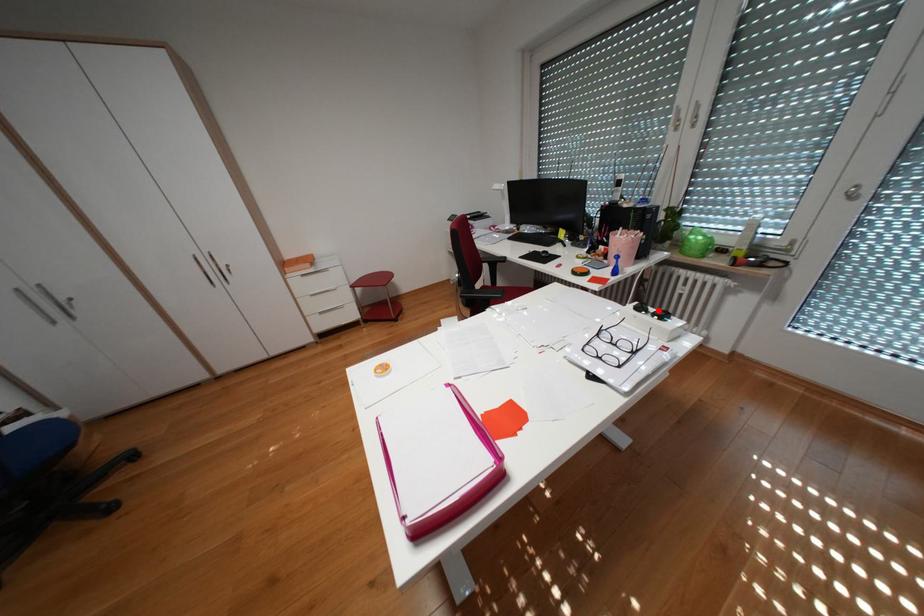
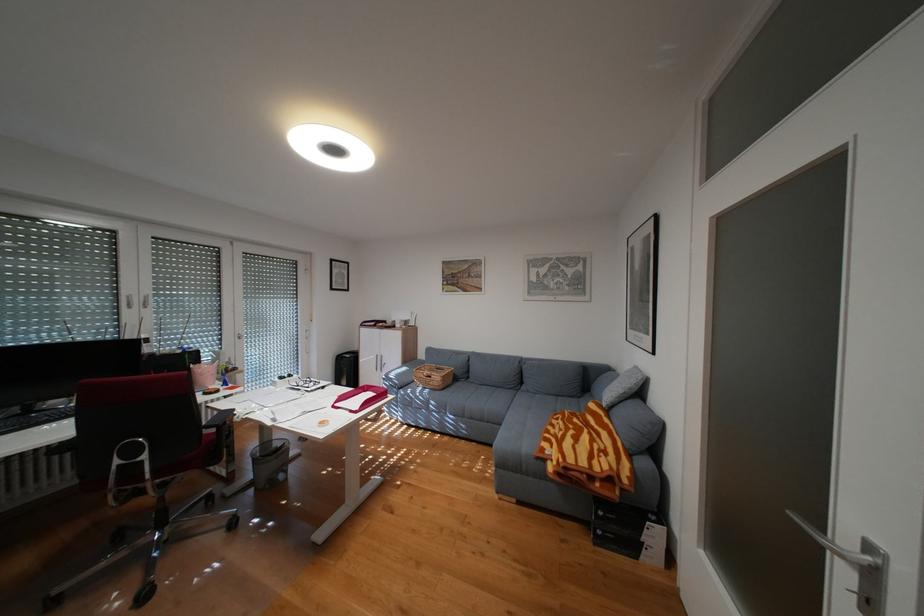
Question: I am providing you with two images of the same scene from different viewpoints. A red point is shown in image1. For the corresponding object point in image2, is it positioned nearer or farther from the camera?

Choices:
 (A) Nearer
 (B) Farther

Answer: (A)